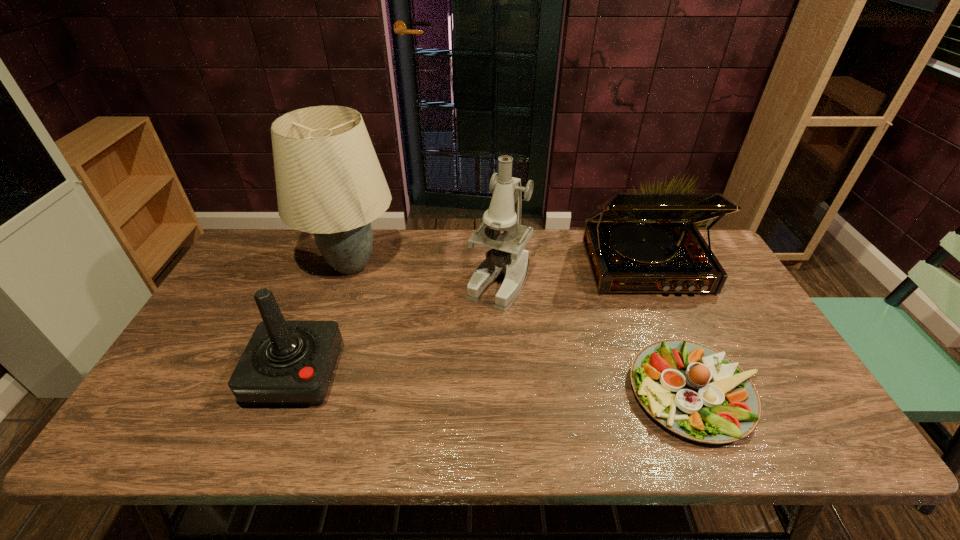
The height and width of the screenshot is (540, 960). In order to click on blank area located 0.150m on the left of the shortest object in this screenshot , I will do `click(568, 393)`.

Find the location of a particular element. lampshade that is at the far edge is located at coordinates (329, 182).

Where is `microscope at the far edge`? microscope at the far edge is located at coordinates (507, 258).

Image resolution: width=960 pixels, height=540 pixels. I want to click on record player positioned at the far edge, so click(635, 242).

This screenshot has width=960, height=540. What are the coordinates of `object located in the near edge section of the desktop` in the screenshot? It's located at [695, 391].

Where is `record player situated at the right edge`? record player situated at the right edge is located at coordinates (635, 242).

This screenshot has width=960, height=540. In order to click on salad plate that is at the right edge in this screenshot , I will do `click(695, 391)`.

This screenshot has width=960, height=540. I want to click on object at the far right corner, so click(635, 242).

I want to click on object that is at the near right corner, so pyautogui.click(x=695, y=391).

The image size is (960, 540). Find the location of `blank space at the far edge`. blank space at the far edge is located at coordinates (421, 239).